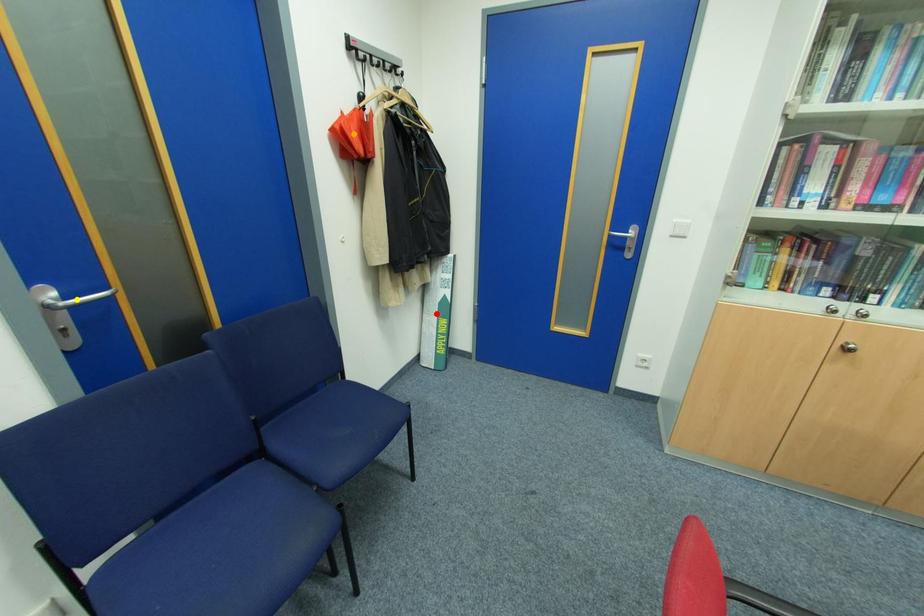
Order these from nearest to farthest:
yellow point | orange point | red point

red point < orange point < yellow point